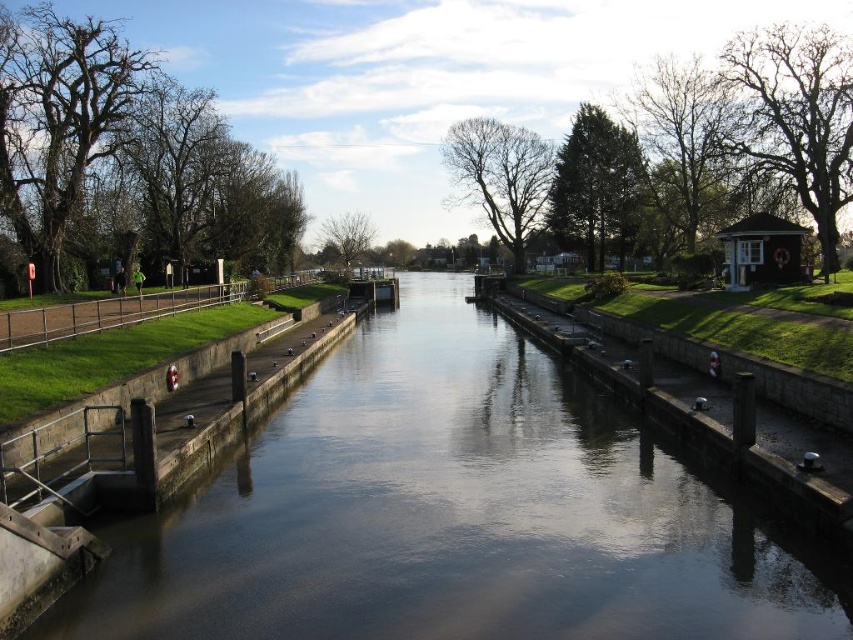
Question: In this image, where is bare branches at left located relative to bare branches at center?

Choices:
 (A) right
 (B) left

Answer: (B)

Question: Is brown concrete river at center smaller than bare branches at center?

Choices:
 (A) yes
 (B) no

Answer: (A)

Question: Which of the following is the farthest from the observer?

Choices:
 (A) (450, 140)
 (B) (55, 138)

Answer: (A)

Question: Estimate the real-world distances between objects in this image. Which object is closer to the brown concrete river at center?

Choices:
 (A) green leafy tree at upper right
 (B) green textured tree at upper center

Answer: (A)

Question: Can you confirm if brown concrete river at center is bigger than brown textured tree at upper right?

Choices:
 (A) yes
 (B) no

Answer: (B)

Question: Which of the following is the closest to the observer?

Choices:
 (A) (570, 192)
 (B) (485, 211)

Answer: (A)